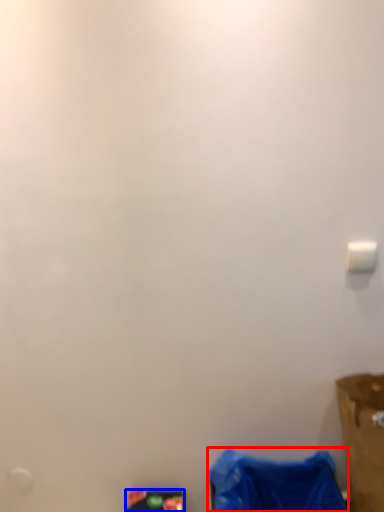
Question: Which object is further to the camera taking this photo, waste (highlighted by a red box) or waste (highlighted by a blue box)?

Choices:
 (A) waste
 (B) waste

Answer: (B)